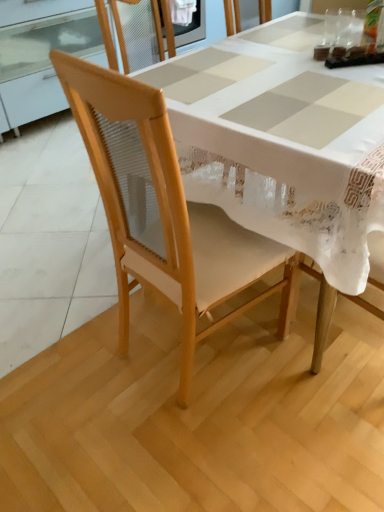
I want to click on empty space that is to the right of transparent plastic cup at upper right, placed as the first tableware when sorted from left to right, so click(x=354, y=40).